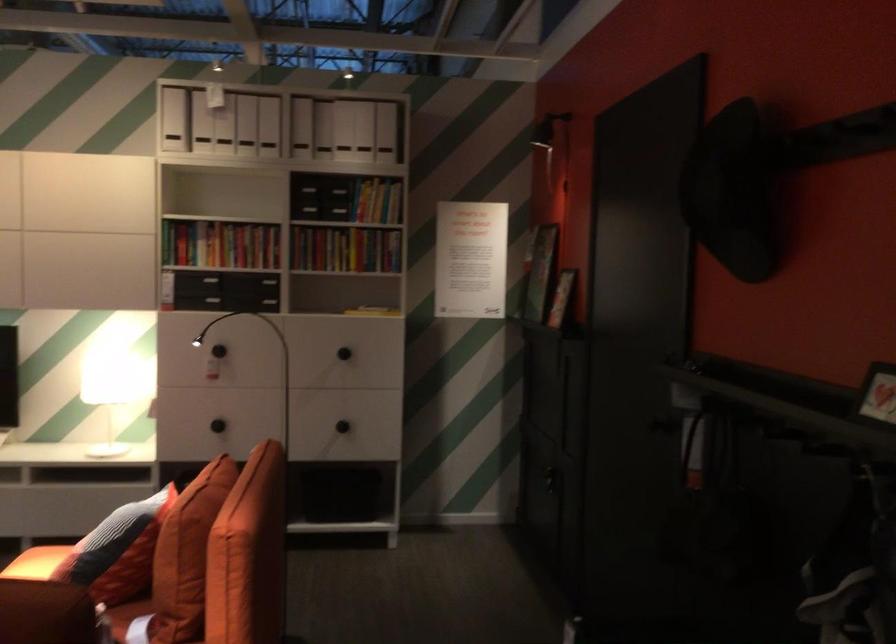
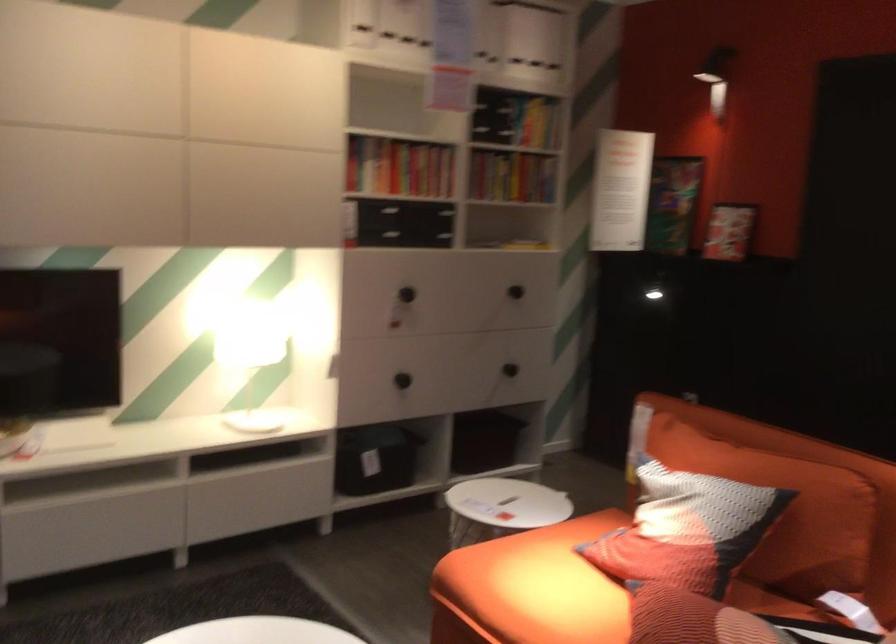
Where in the second image is the point corresponding to (x=352, y=211) from the first image?

(538, 124)